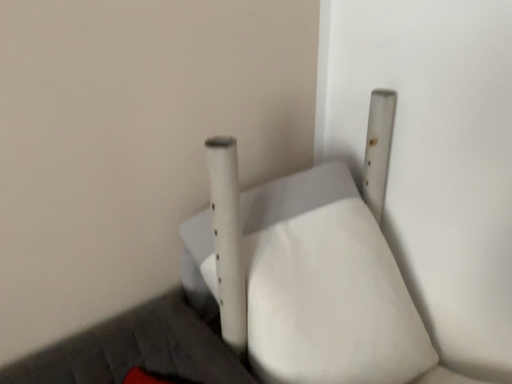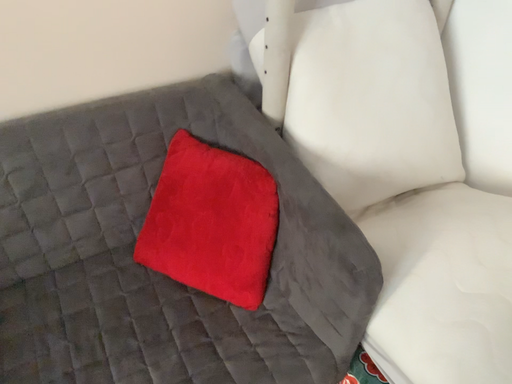
Question: Which way did the camera rotate in the video?

Choices:
 (A) rotated right
 (B) rotated left

Answer: (B)